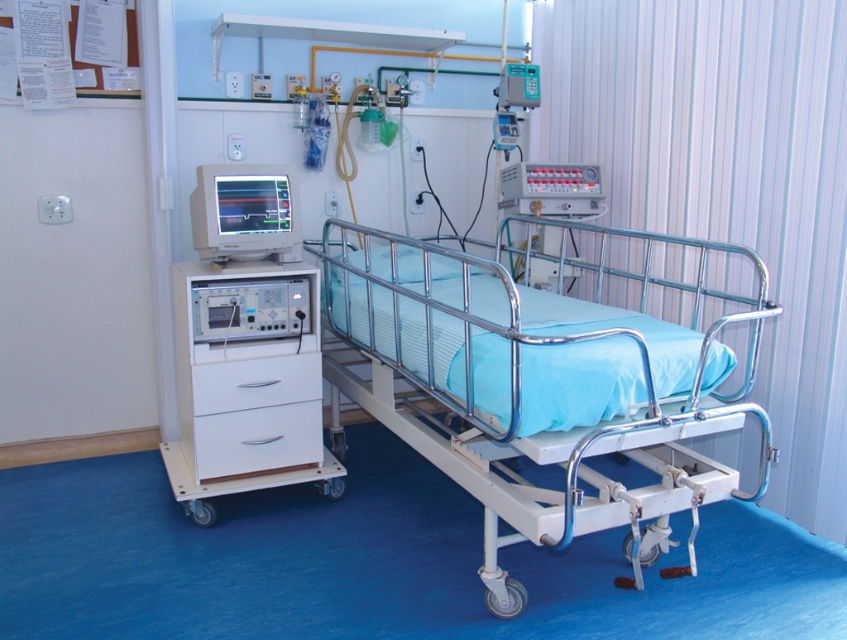
You are a nurse entering the hospital room and need to locate the point at coordinates (x=534, y=385). According to the scene description, where exactly is this point located?

The point at coordinates (x=534, y=385) is located on the metallic blue bed at center.